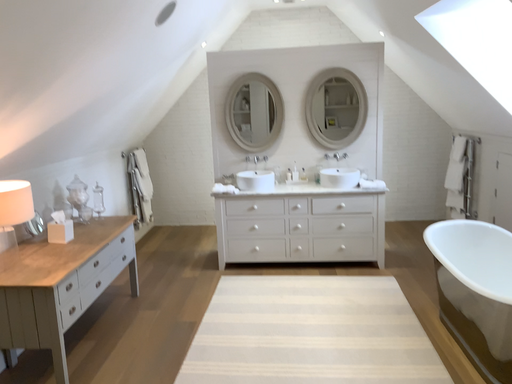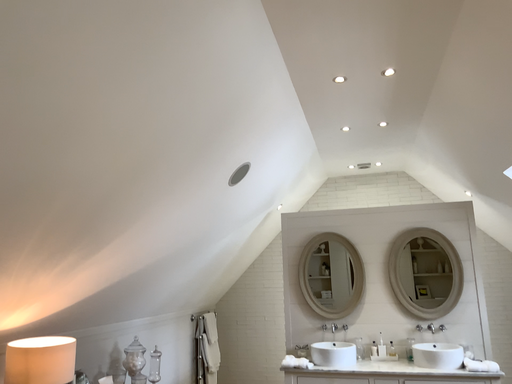
Question: Which way did the camera rotate in the video?

Choices:
 (A) rotated left
 (B) rotated right

Answer: (A)